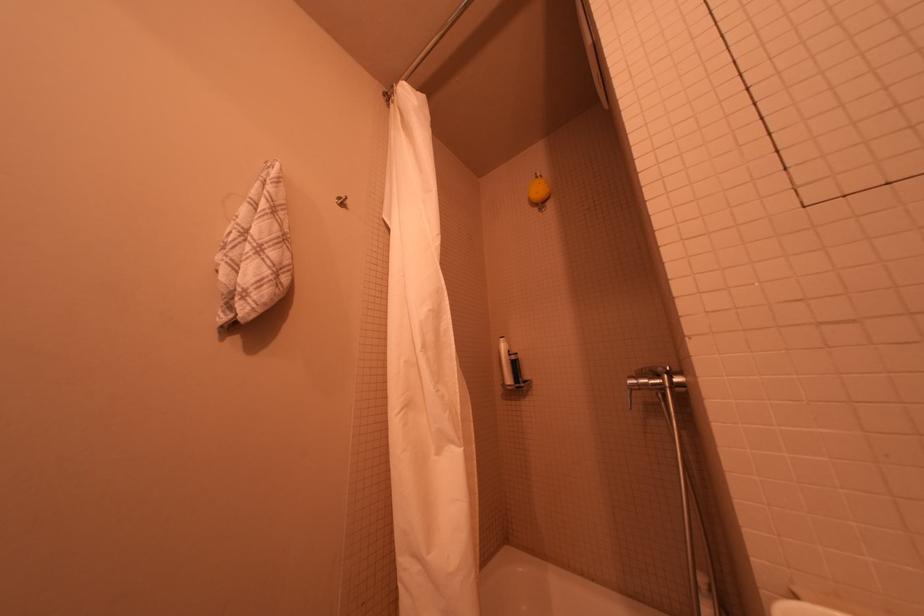
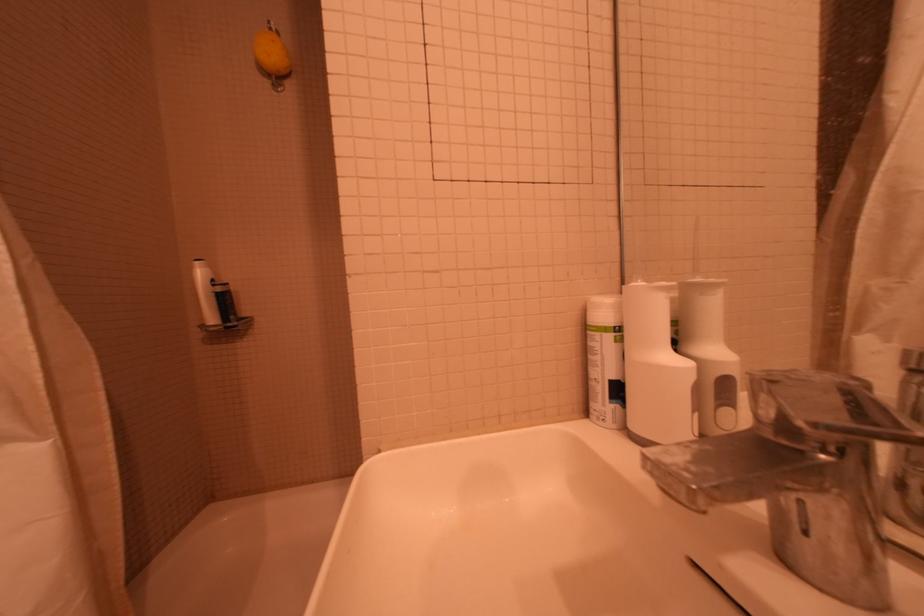
In the second image, find the point that corresponds to [549,185] in the first image.

(281, 42)